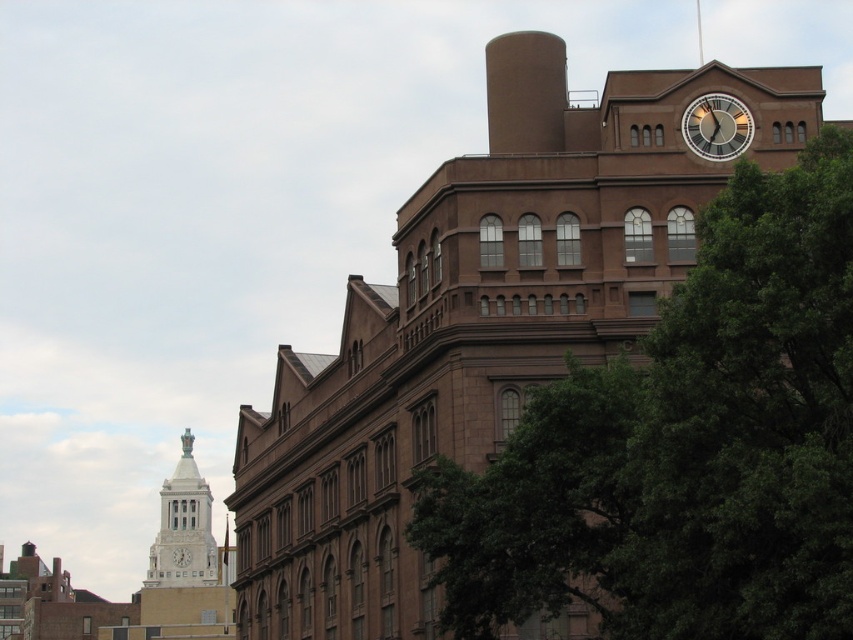
Question: Is green leafy tree at upper right smaller than white stone clock tower at left?

Choices:
 (A) no
 (B) yes

Answer: (B)

Question: From the image, what is the correct spatial relationship of brown matte chimney at upper center in relation to white stone clock tower at left?

Choices:
 (A) left
 (B) right

Answer: (B)

Question: Which object is closer to the camera taking this photo?

Choices:
 (A) white stone clock tower at left
 (B) white marble clock at upper center
 (C) green leafy tree at upper right
 (D) white glossy clock at upper right

Answer: (C)

Question: Based on their relative distances, which object is nearer to the brown matte chimney at upper center?

Choices:
 (A) white glossy clock at upper right
 (B) green leafy tree at upper right
 (C) white stone clock tower at left
 (D) white marble clock at upper center

Answer: (A)

Question: Which of the following is the closest to the observer?

Choices:
 (A) tap(194, 540)
 (B) tap(495, 60)

Answer: (B)

Question: Observing the image, what is the correct spatial positioning of white stone clock tower at left in reference to white glossy clock at upper right?

Choices:
 (A) below
 (B) above

Answer: (A)